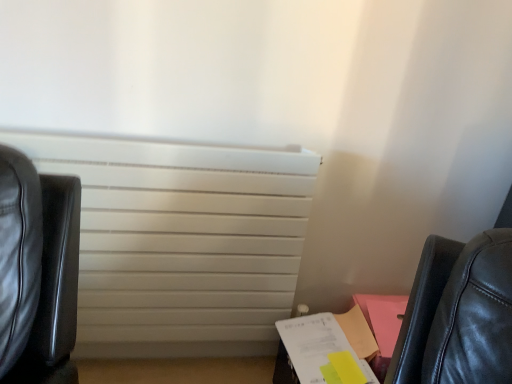
Question: Would you say white matte radiator at center is inside or outside white paper at lower right?

Choices:
 (A) outside
 (B) inside

Answer: (A)

Question: Relative to white paper at lower right, is white matte radiator at center in front or behind?

Choices:
 (A) behind
 (B) front

Answer: (B)

Question: Is point (113, 228) positioned closer to the camera than point (296, 337)?

Choices:
 (A) farther
 (B) closer

Answer: (B)

Question: Looking at the image, does white paper at lower right seem bigger or smaller compared to white matte radiator at center?

Choices:
 (A) small
 (B) big

Answer: (A)

Question: From a real-world perspective, is white paper at lower right above or below white matte radiator at center?

Choices:
 (A) above
 (B) below

Answer: (B)

Question: Considering the relative positions of white paper at lower right and white matte radiator at center in the image provided, is white paper at lower right to the left or to the right of white matte radiator at center?

Choices:
 (A) right
 (B) left

Answer: (A)

Question: Is white paper at lower right spatially inside white matte radiator at center, or outside of it?

Choices:
 (A) inside
 (B) outside

Answer: (B)